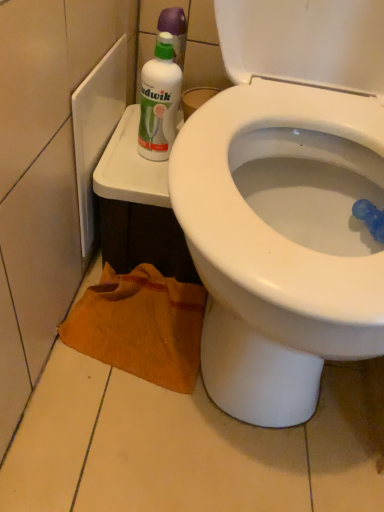
You are a GUI agent. You are given a task and a screenshot of the screen. Output one action in this format:
    pyautogui.click(x=<x>, y=<y>)
    Task: Click on the vacant space underneath brown fabric towel at lower left (from a real-world perspective)
    
    Given the screenshot: What is the action you would take?
    pyautogui.click(x=117, y=326)